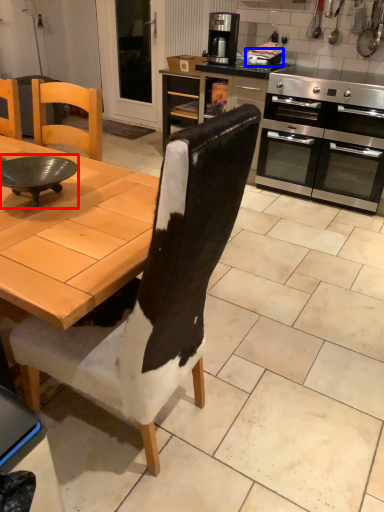
Question: Which object appears farthest to the camera in this image, round table (highlighted by a red box) or appliance (highlighted by a blue box)?

Choices:
 (A) round table
 (B) appliance

Answer: (B)